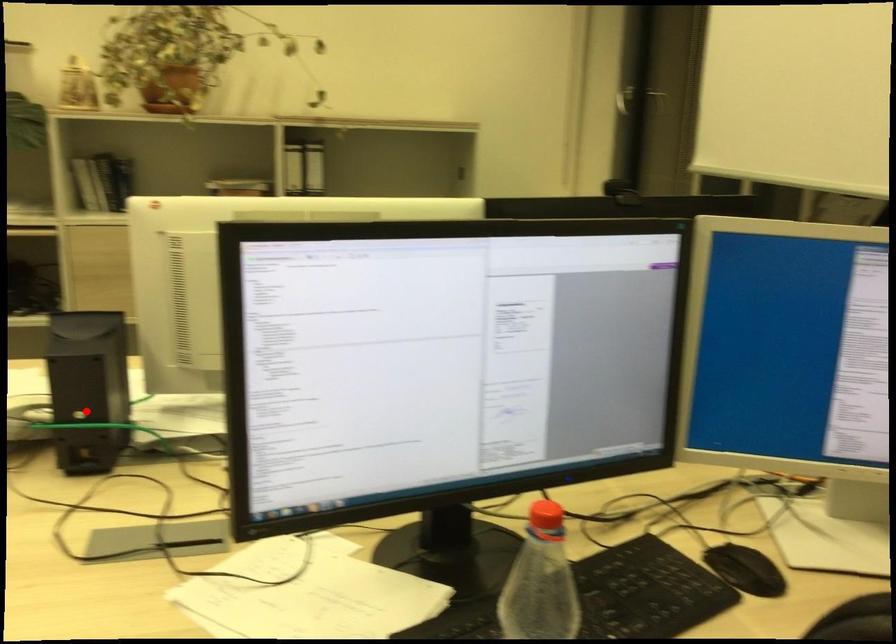
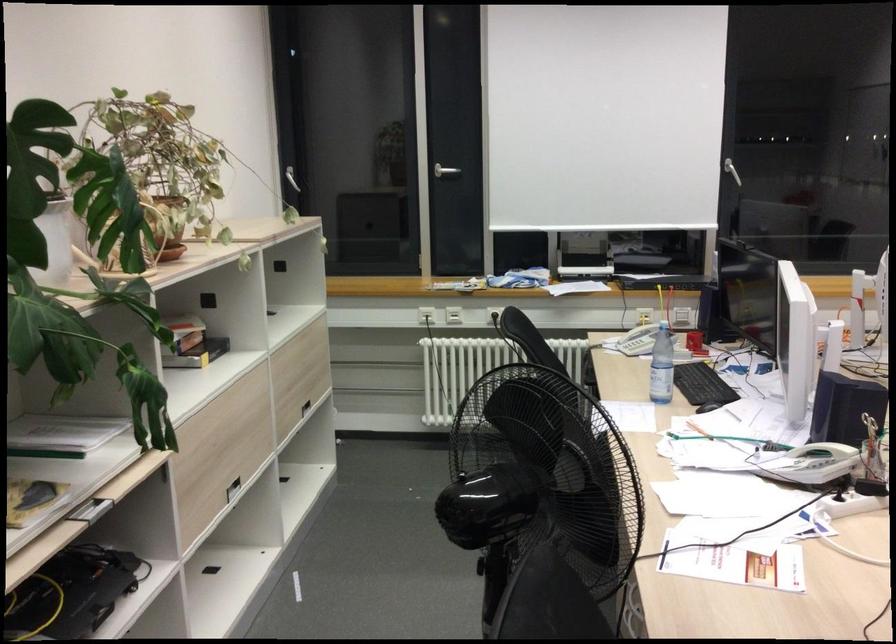
Question: I am providing you with two images of the same scene from different viewpoints. Given a red point in image1, look at the same physical point in image2. Is it:

Choices:
 (A) Closer to the viewpoint
 (B) Farther from the viewpoint

Answer: (B)